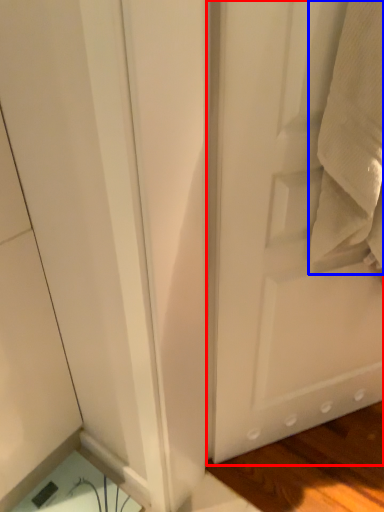
Question: Which point is further to the camera, door (highlighted by a red box) or bath towel (highlighted by a blue box)?

Choices:
 (A) door
 (B) bath towel

Answer: (A)